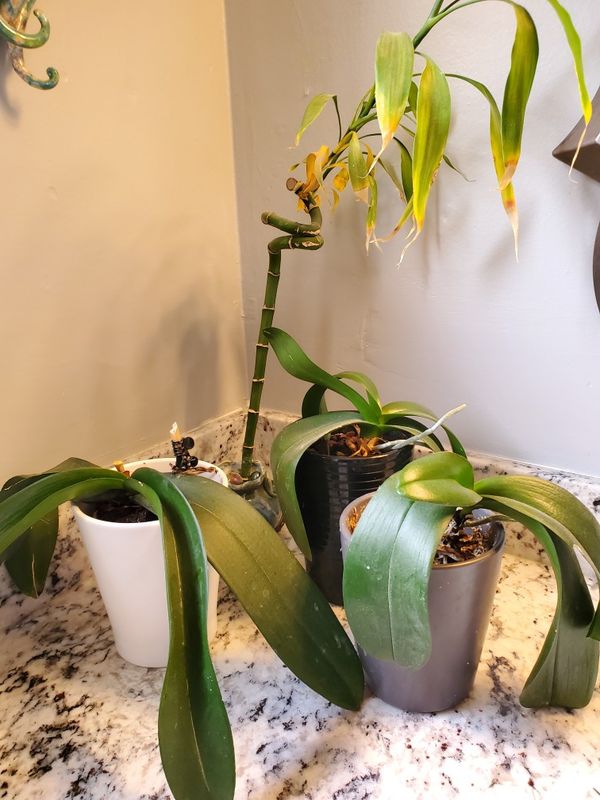
You are a GUI agent. You are given a task and a screenshot of the screen. Output one action in this format:
    pyautogui.click(x=<x>, y=<y>)
    Task: Click on the shadow on wall
    
    Given the screenshot: What is the action you would take?
    pyautogui.click(x=351, y=244), pyautogui.click(x=201, y=365)